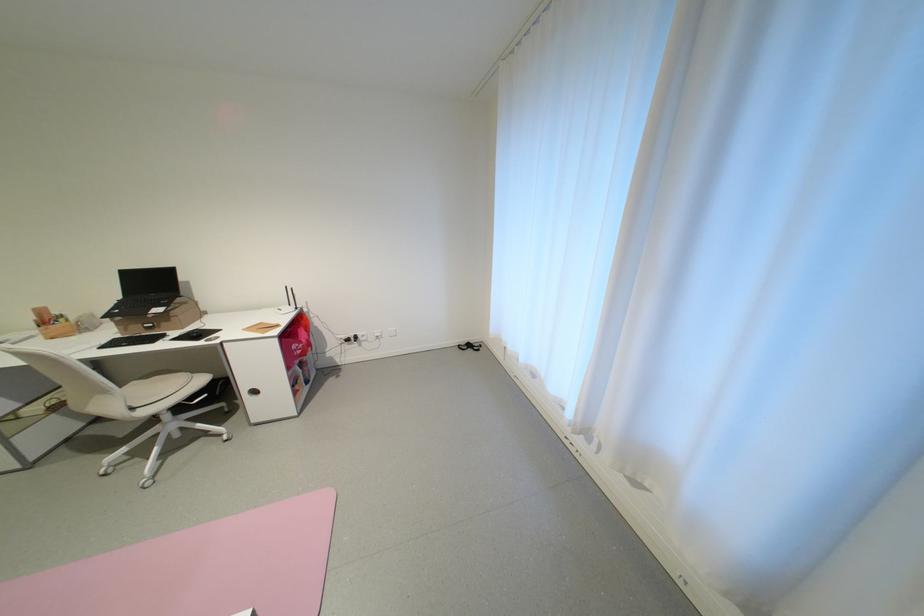
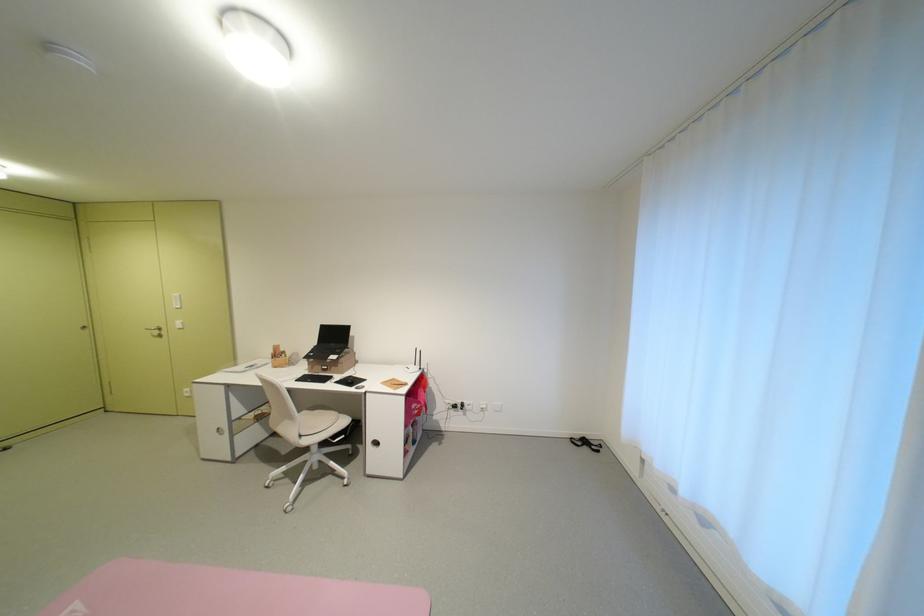
Locate, in the second image, the point that corresponds to the point at 146,408 in the first image.

(311, 436)